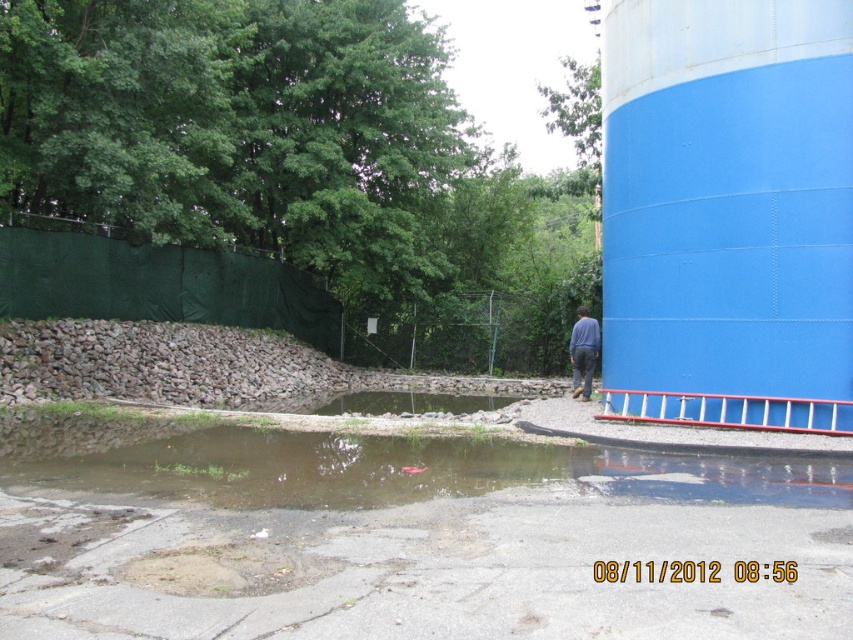
Is brown concrete flood at lower center to the right of blue jeans at lower right from the viewer's perspective?

No, brown concrete flood at lower center is not to the right of blue jeans at lower right.

Between brown concrete flood at lower center and blue jeans at lower right, which one is positioned higher?

Positioned higher is blue jeans at lower right.

Find the location of `brown concrete flood at lower center`. brown concrete flood at lower center is located at coordinates (375, 467).

This screenshot has height=640, width=853. Find the location of `brown concrete flood at lower center`. brown concrete flood at lower center is located at coordinates (375, 467).

Is point (764, 38) in front of point (575, 387)?

That is True.

Is blue painted steel water tower at right to the right of blue jeans at lower right from the viewer's perspective?

Indeed, blue painted steel water tower at right is positioned on the right side of blue jeans at lower right.

Is point (770, 312) more distant than point (573, 332)?

No, it is in front of (573, 332).

I want to click on blue painted steel water tower at right, so click(728, 212).

Is point (722, 228) closer to viewer compared to point (20, 420)?

Yes, it is in front of point (20, 420).

What do you see at coordinates (728, 212) in the screenshot? Image resolution: width=853 pixels, height=640 pixels. I see `blue painted steel water tower at right` at bounding box center [728, 212].

Locate an element on the screen. This screenshot has width=853, height=640. blue painted steel water tower at right is located at coordinates (728, 212).

At what (x,y) coordinates should I click in order to perform the action: click on blue painted steel water tower at right. Please return your answer as a coordinate pair (x, y). This screenshot has width=853, height=640. Looking at the image, I should click on (728, 212).